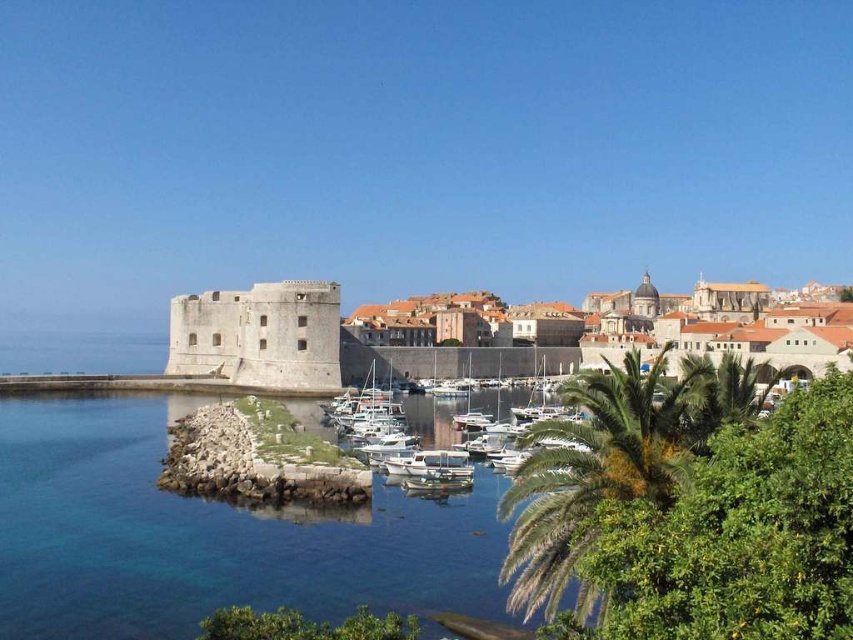
You are standing on the pier and notice the clear blue water at lower left and the white glossy boats at center. Which object is positioned to the left of the other?

The clear blue water at lower left is to the left of white glossy boats at center.

Based on the photo, you are a photographer planning to capture a sunset shot from the fort. You want to ensure the green leafy palm tree at lower right and the white glossy boats at center are both visible in your frame. Based on their heights, which object will appear larger in the photo?

The green leafy palm tree at lower right is taller than the white glossy boats at center, so it will appear larger in the photo.